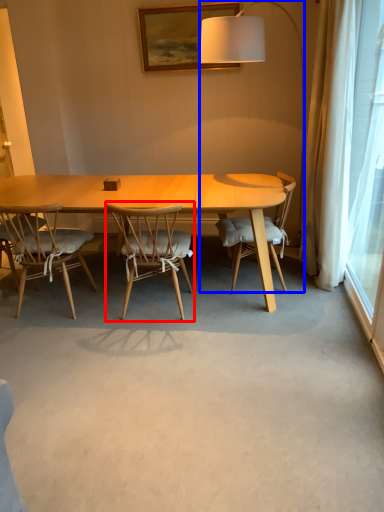
Question: Which point is closer to the camera, chair (highlighted by a red box) or lamp (highlighted by a blue box)?

Choices:
 (A) chair
 (B) lamp

Answer: (A)